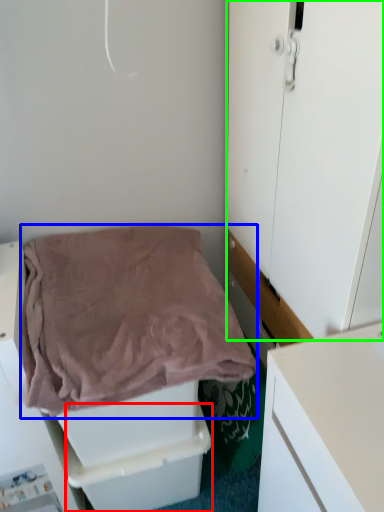
Question: Considering the real-world distances, which object is farthest from drawer (highlighted by a red box)? blanket (highlighted by a blue box) or door (highlighted by a green box)?

Choices:
 (A) blanket
 (B) door

Answer: (B)